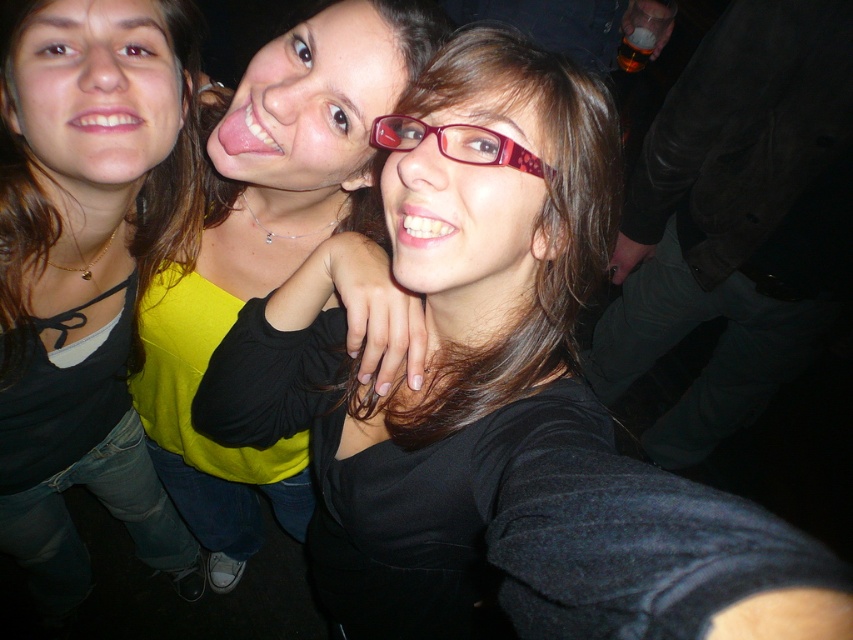
Is matte black top at center further to the viewer compared to dark green corduroy pants at lower right?

No, it is not.

Between matte black top at center and dark green corduroy pants at lower right, which one has less height?

With less height is matte black top at center.

Between point (25, 44) and point (743, 138), which one is positioned behind?

Positioned behind is point (743, 138).

Locate an element on the screen. This screenshot has height=640, width=853. matte black top at center is located at coordinates (86, 273).

Which is below, matte black top at center or matte red glasses at center?

Result: matte black top at center is below.

Where is `matte black top at center`? matte black top at center is located at coordinates (86, 273).

Who is positioned more to the left, dark green corduroy pants at lower right or yellow matte sweater at center?

yellow matte sweater at center

Can you confirm if dark green corduroy pants at lower right is positioned to the right of yellow matte sweater at center?

Yes, dark green corduroy pants at lower right is to the right of yellow matte sweater at center.

Looking at this image, who is more distant from viewer, (733, 401) or (373, 6)?

The point (733, 401) is behind.

Where is `dark green corduroy pants at lower right`? Image resolution: width=853 pixels, height=640 pixels. dark green corduroy pants at lower right is located at coordinates (735, 220).